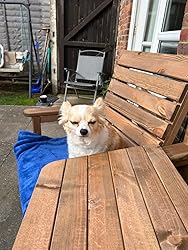
This screenshot has height=250, width=188. Find the location of `windows`. windows is located at coordinates (174, 17), (166, 48).